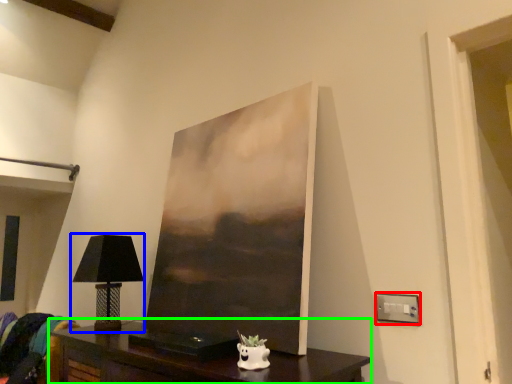
Question: Based on their relative distances, which object is nearer to electric outlet (highlighted by a red box)? Choose from table lamp (highlighted by a blue box) and table (highlighted by a green box).

Choices:
 (A) table lamp
 (B) table

Answer: (B)